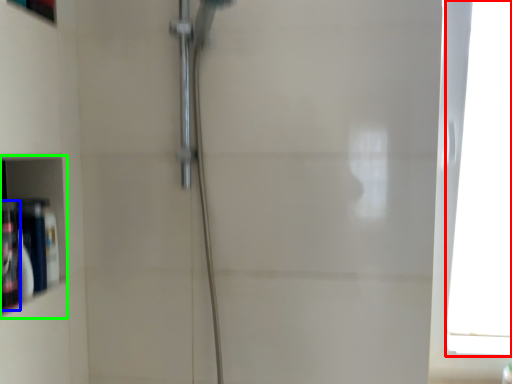
Question: Estimate the real-world distances between objects in this image. Which object is farther from window (highlighted by a red box), toiletry (highlighted by a blue box) or cabinet (highlighted by a green box)?

Choices:
 (A) toiletry
 (B) cabinet

Answer: (A)